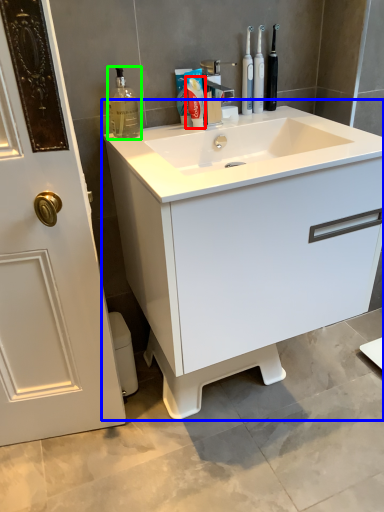
Question: Based on their relative distances, which object is farther from toothpaste (highlighted by a red box)? Choose from bathroom cabinet (highlighted by a blue box) and cleaning product (highlighted by a green box).

Choices:
 (A) bathroom cabinet
 (B) cleaning product

Answer: (A)